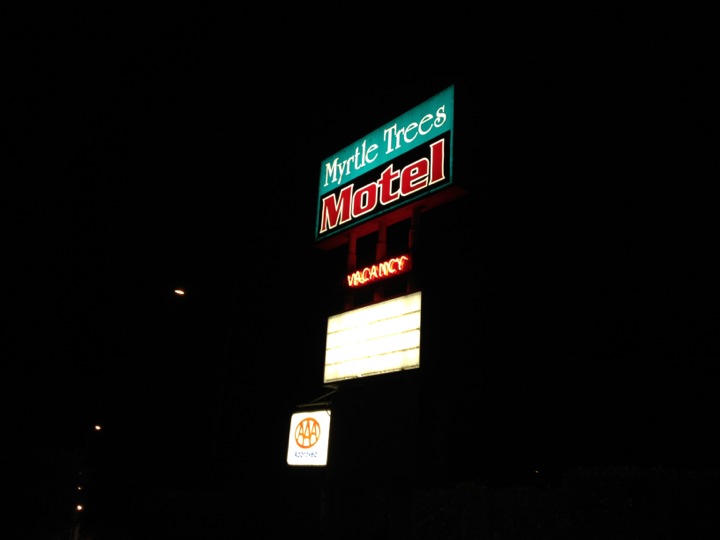
The image size is (720, 540). I want to click on lit up letter, so click(346, 278), click(356, 280), click(368, 278), click(374, 272), click(386, 264), click(392, 264), click(402, 260).